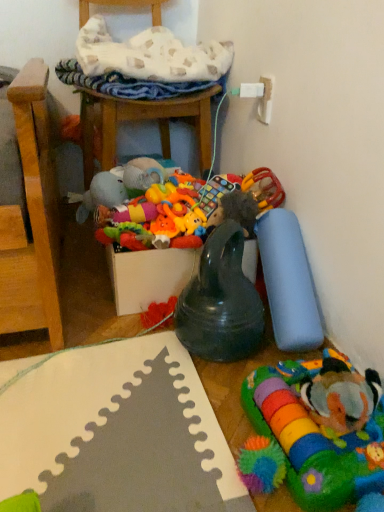
Question: From the image's perspective, would you say soft plush clownfish at lower right, marked as the 1th toy in a right-to-left arrangement, is shown under soft plush toy at center, placed as the fifth toy when sorted from right to left?

Choices:
 (A) yes
 (B) no

Answer: (A)

Question: Is soft plush clownfish at lower right, marked as the fifth toy in a left-to-right arrangement, oriented towards soft plush toy at center, acting as the 1th toy starting from the left?

Choices:
 (A) no
 (B) yes

Answer: (A)

Question: Is soft plush clownfish at lower right, marked as the fifth toy in a left-to-right arrangement, not close to soft plush toy at center, acting as the 1th toy starting from the left?

Choices:
 (A) yes
 (B) no

Answer: (B)

Question: Is soft plush toy at center, placed as the fifth toy when sorted from right to left, inside soft plush clownfish at lower right, marked as the fifth toy in a left-to-right arrangement?

Choices:
 (A) yes
 (B) no

Answer: (B)

Question: Is soft plush clownfish at lower right, marked as the fifth toy in a left-to-right arrangement, taller than soft plush toy at center, placed as the fifth toy when sorted from right to left?

Choices:
 (A) no
 (B) yes

Answer: (A)

Question: Is soft plush clownfish at lower right, marked as the 1th toy in a right-to-left arrangement, positioned in front of soft plush toy at center, acting as the 1th toy starting from the left?

Choices:
 (A) no
 (B) yes

Answer: (B)

Question: Can you confirm if wooden chair at upper center is positioned to the left of soft plush clownfish at lower right, marked as the fifth toy in a left-to-right arrangement?

Choices:
 (A) yes
 (B) no

Answer: (A)

Question: Does wooden chair at upper center have a larger size compared to soft plush clownfish at lower right, marked as the fifth toy in a left-to-right arrangement?

Choices:
 (A) no
 (B) yes

Answer: (B)

Question: Considering the relative positions of wooden chair at upper center and soft plush clownfish at lower right, marked as the fifth toy in a left-to-right arrangement, in the image provided, is wooden chair at upper center to the right of soft plush clownfish at lower right, marked as the fifth toy in a left-to-right arrangement, from the viewer's perspective?

Choices:
 (A) no
 (B) yes

Answer: (A)

Question: Is wooden chair at upper center oriented away from soft plush clownfish at lower right, marked as the 1th toy in a right-to-left arrangement?

Choices:
 (A) yes
 (B) no

Answer: (B)

Question: Can you confirm if wooden chair at upper center is taller than soft plush clownfish at lower right, marked as the 1th toy in a right-to-left arrangement?

Choices:
 (A) no
 (B) yes

Answer: (B)

Question: From the image's perspective, is wooden chair at upper center located above soft plush clownfish at lower right, marked as the fifth toy in a left-to-right arrangement?

Choices:
 (A) yes
 (B) no

Answer: (A)

Question: Is wooden chair at upper center located within rubberized plastic rattle at right, placed as the third toy when sorted from left to right?

Choices:
 (A) no
 (B) yes

Answer: (A)